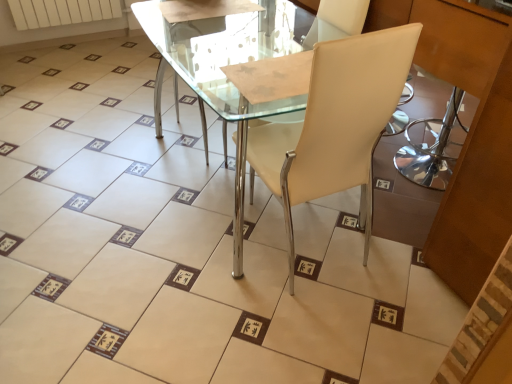
Where is `free space in front of beige leather chair at center`? Image resolution: width=512 pixels, height=384 pixels. free space in front of beige leather chair at center is located at coordinates (308, 324).